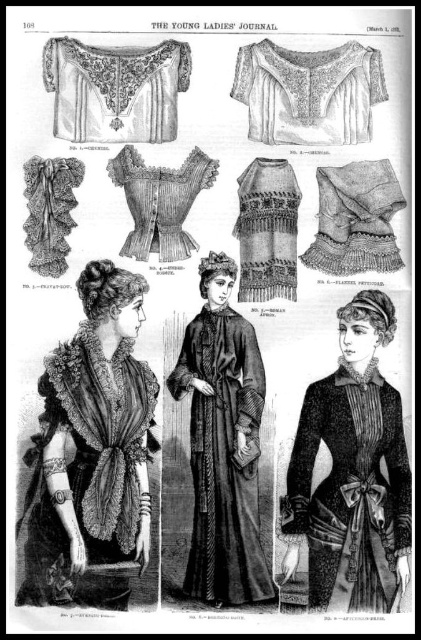
Which object is positioned lower on the page between the matte black dress at center and the matte white lace corset at center?

The matte black dress at center is positioned lower than the matte white lace corset at center.